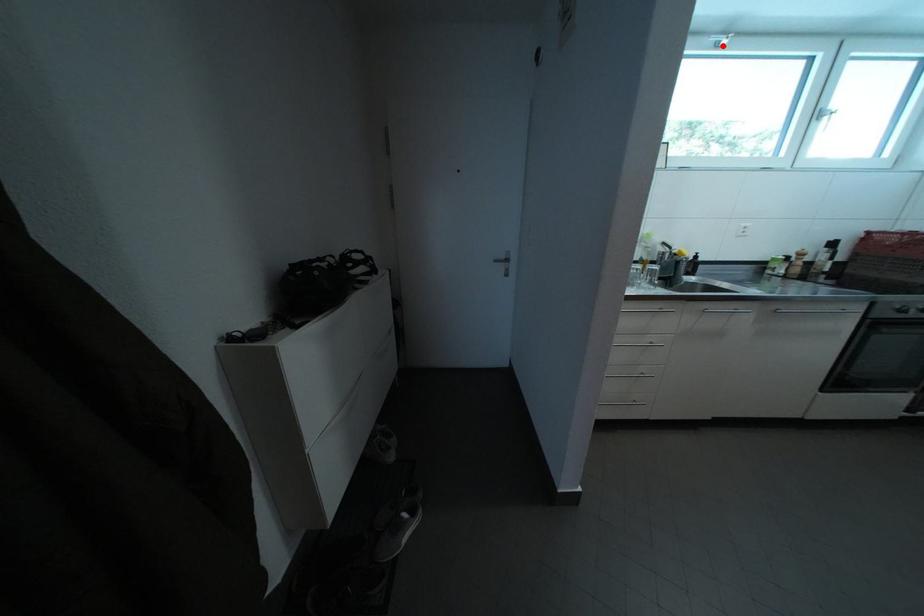
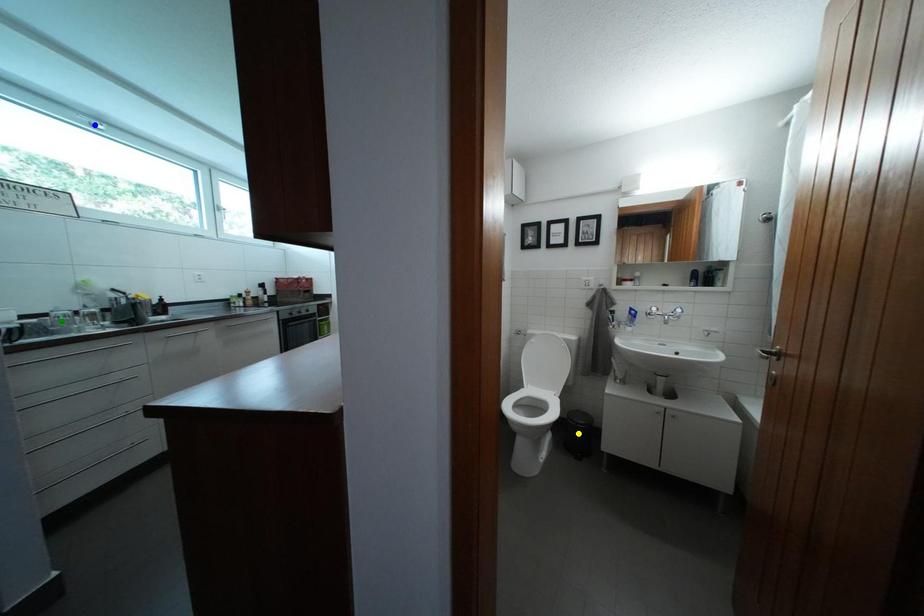
Question: I am providing you with two images of the same scene from different viewpoints. A red point is marked on the first image. You are given multiple points on the second image. Which mark in image 2 goes with the point in image 1?

Choices:
 (A) green point
 (B) yellow point
 (C) blue point

Answer: (C)